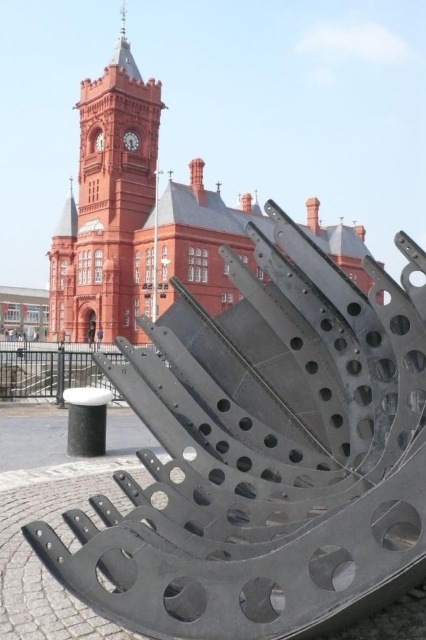
Question: Does black metallic sculpture at center have a lesser width compared to matte red clock tower at upper left?

Choices:
 (A) no
 (B) yes

Answer: (A)

Question: Which of the following is the closest to the observer?

Choices:
 (A) black metallic sculpture at center
 (B) matte red clock tower at upper left

Answer: (A)

Question: Among these points, which one is farthest from the camera?

Choices:
 (A) (328, 506)
 (B) (78, 282)

Answer: (B)

Question: Is black metallic sculpture at center above matte red clock tower at upper left?

Choices:
 (A) yes
 (B) no

Answer: (B)

Question: Is black metallic sculpture at center in front of matte red clock tower at upper left?

Choices:
 (A) no
 (B) yes

Answer: (B)